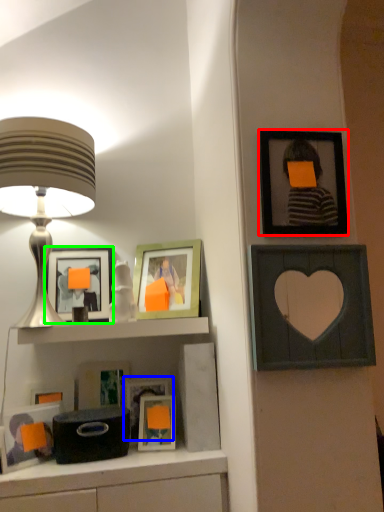
Question: Considering the real-world distances, which object is closest to picture frame (highlighted by a red box)? picture frame (highlighted by a blue box) or picture frame (highlighted by a green box).

Choices:
 (A) picture frame
 (B) picture frame

Answer: (B)